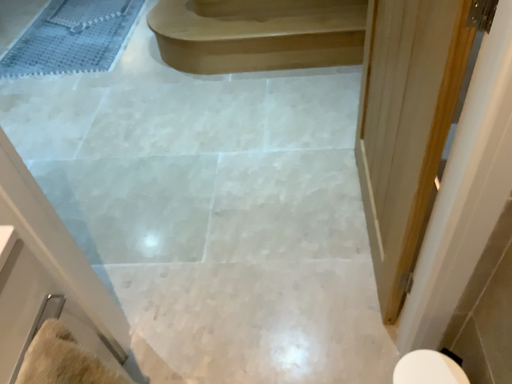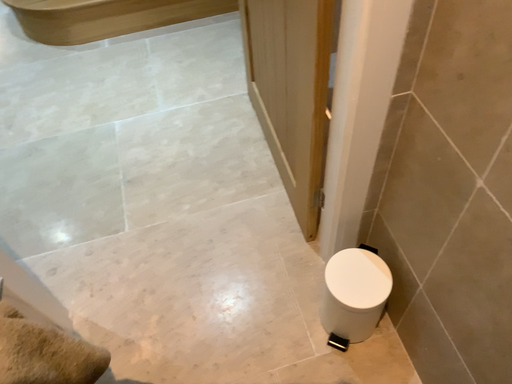
Question: Which way did the camera rotate in the video?

Choices:
 (A) rotated left
 (B) rotated right

Answer: (B)